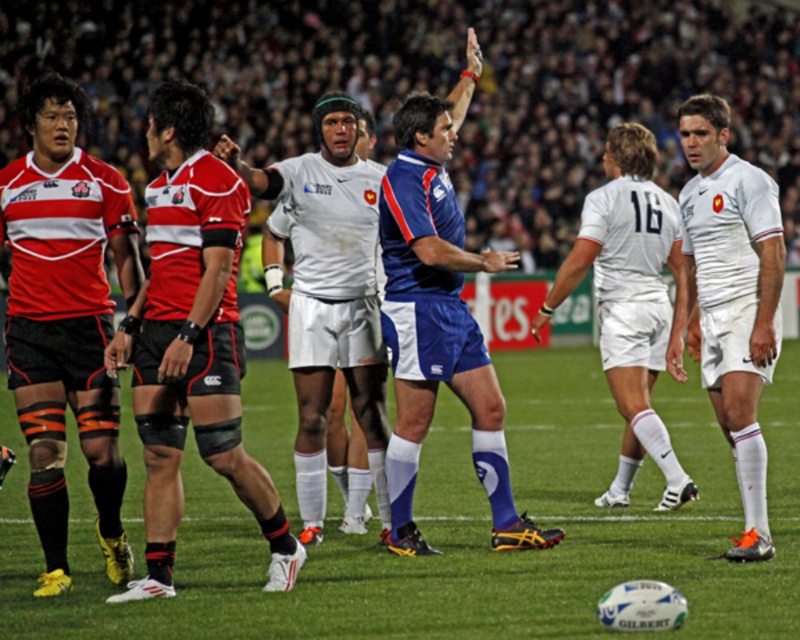
Looking at this image, can you confirm if green grass football field at center is smaller than matte red jersey at left?

Incorrect, green grass football field at center is not smaller in size than matte red jersey at left.

Is green grass football field at center below matte red jersey at left?

Yes, green grass football field at center is below matte red jersey at left.

This screenshot has height=640, width=800. In order to click on green grass football field at center in this screenshot , I will do `click(454, 531)`.

The width and height of the screenshot is (800, 640). In order to click on green grass football field at center in this screenshot , I will do `click(454, 531)`.

Can you confirm if green grass football field at center is positioned above white smooth shorts at center?

Incorrect, green grass football field at center is not positioned above white smooth shorts at center.

How far apart are green grass football field at center and white smooth shorts at center?

A distance of 8.84 feet exists between green grass football field at center and white smooth shorts at center.

What do you see at coordinates (454, 531) in the screenshot? I see `green grass football field at center` at bounding box center [454, 531].

At what (x,y) coordinates should I click in order to perform the action: click on green grass football field at center. Please return your answer as a coordinate pair (x, y). Looking at the image, I should click on (454, 531).

Between point (46, 291) and point (656, 365), which one is positioned behind?

The point (656, 365) is more distant.

Does matte red rugby jersey at left have a greater width compared to white smooth shorts at center?

Answer: Incorrect, matte red rugby jersey at left's width does not surpass white smooth shorts at center's.

Locate an element on the screen. The width and height of the screenshot is (800, 640). matte red rugby jersey at left is located at coordinates (66, 317).